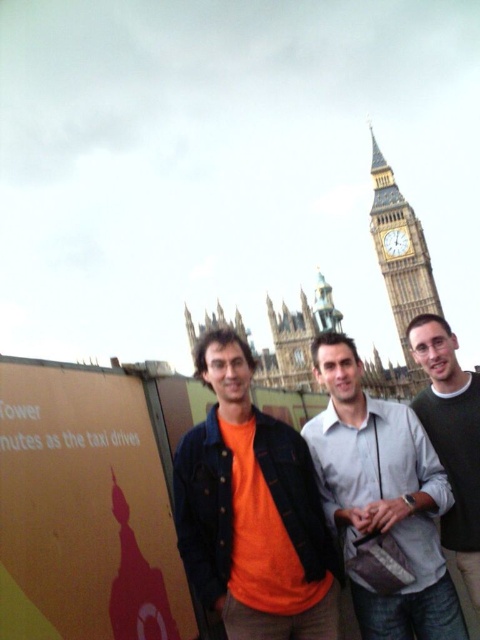
Which of these two, light gray shirt at center or green sweater at center, stands taller?

With more height is green sweater at center.

Based on the photo, who is positioned more to the left, light gray shirt at center or green sweater at center?

Positioned to the left is light gray shirt at center.

Identify the location of light gray shirt at center. The image size is (480, 640). (383, 496).

At what (x,y) coordinates should I click in order to perform the action: click on light gray shirt at center. Please return your answer as a coordinate pair (x, y). Looking at the image, I should click on (383, 496).

How much distance is there between orange matte shirt at center and green sweater at center?

orange matte shirt at center and green sweater at center are 40.67 meters apart from each other.

Between point (256, 548) and point (463, 513), which one is positioned behind?

The point (463, 513) is more distant.

Locate an element on the screen. The height and width of the screenshot is (640, 480). orange matte shirt at center is located at coordinates pyautogui.click(x=252, y=509).

Between orange matte shirt at center and golden stone clock tower at upper right, which one is positioned lower?

orange matte shirt at center is below.

Where is `orange matte shirt at center`? This screenshot has width=480, height=640. orange matte shirt at center is located at coordinates (252, 509).